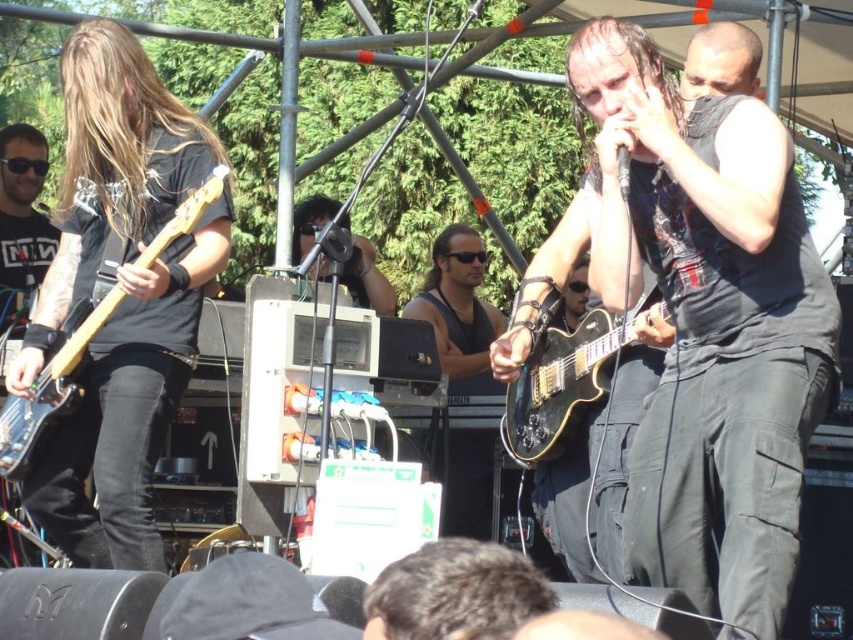
Question: Which point appears closest to the camera in this image?

Choices:
 (A) (532, 465)
 (B) (479, 529)

Answer: (A)

Question: Estimate the real-world distances between objects in this image. Which object is farther from the glossy black guitar at center?

Choices:
 (A) black matte vest at right
 (B) black leather tank top at center
 (C) matte wood guitar at left

Answer: (C)

Question: Which object is farther from the camera taking this photo?

Choices:
 (A) black matte vest at right
 (B) black leather tank top at center
 (C) matte wood guitar at left
 (D) glossy black guitar at center

Answer: (B)

Question: Does glossy black guitar at center appear over matte wood guitar at left?

Choices:
 (A) no
 (B) yes

Answer: (B)

Question: Observing the image, what is the correct spatial positioning of glossy black guitar at center in reference to matte wood guitar at left?

Choices:
 (A) left
 (B) right

Answer: (B)

Question: Is glossy black guitar at center above matte wood guitar at left?

Choices:
 (A) yes
 (B) no

Answer: (A)